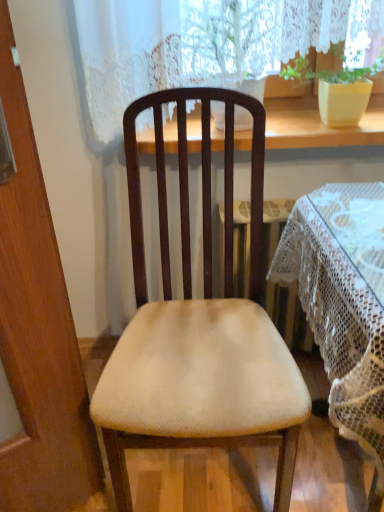
Question: From a real-world perspective, is wooden at upper center positioned under matte yellow pot at upper right based on gravity?

Choices:
 (A) yes
 (B) no

Answer: (A)

Question: Does wooden at upper center appear on the right side of matte yellow pot at upper right?

Choices:
 (A) yes
 (B) no

Answer: (B)

Question: Does wooden at upper center come behind matte yellow pot at upper right?

Choices:
 (A) yes
 (B) no

Answer: (A)

Question: Does wooden at upper center have a larger size compared to matte yellow pot at upper right?

Choices:
 (A) no
 (B) yes

Answer: (B)

Question: Is wooden at upper center thinner than matte yellow pot at upper right?

Choices:
 (A) no
 (B) yes

Answer: (A)

Question: Does wooden at upper center have a greater width compared to matte yellow pot at upper right?

Choices:
 (A) no
 (B) yes

Answer: (B)

Question: From the image's perspective, does white lace tablecloth at center appear higher than wooden at upper center?

Choices:
 (A) yes
 (B) no

Answer: (B)

Question: Does white lace tablecloth at center appear on the left side of wooden at upper center?

Choices:
 (A) no
 (B) yes

Answer: (A)

Question: From a real-world perspective, is white lace tablecloth at center beneath wooden at upper center?

Choices:
 (A) yes
 (B) no

Answer: (A)

Question: Does white lace tablecloth at center have a lesser width compared to wooden at upper center?

Choices:
 (A) yes
 (B) no

Answer: (B)

Question: Does white lace tablecloth at center have a lesser height compared to wooden at upper center?

Choices:
 (A) yes
 (B) no

Answer: (B)

Question: Does white lace tablecloth at center lie in front of wooden at upper center?

Choices:
 (A) no
 (B) yes

Answer: (B)

Question: Is wooden at upper center surrounding white lace tablecloth at center?

Choices:
 (A) no
 (B) yes

Answer: (A)